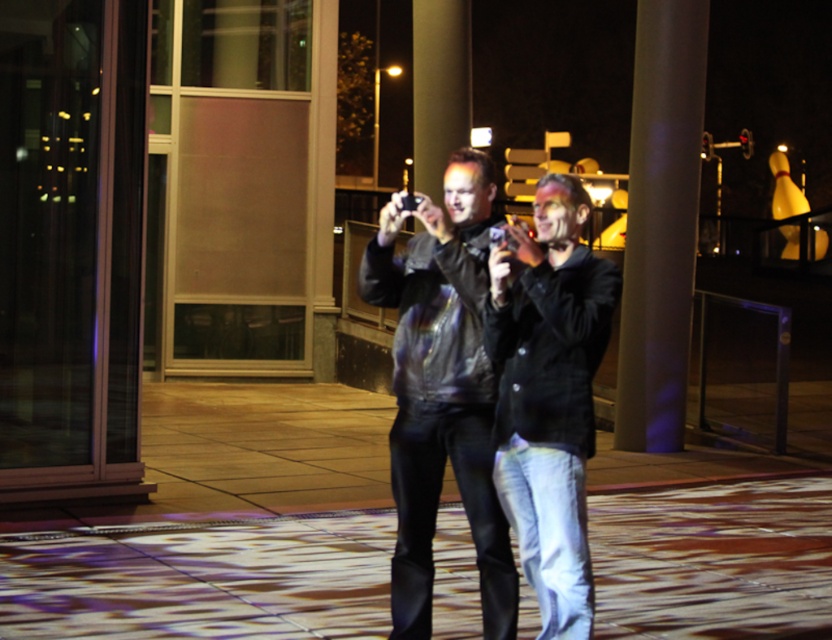
Question: Which of the following is the closest to the observer?

Choices:
 (A) (528, 273)
 (B) (404, 593)

Answer: (A)

Question: Is denim jeans at center thinner than shiny black jacket at center?

Choices:
 (A) yes
 (B) no

Answer: (A)

Question: From the image, what is the correct spatial relationship of denim jeans at center in relation to shiny black jacket at center?

Choices:
 (A) below
 (B) above

Answer: (A)

Question: Which point is farther to the camera?

Choices:
 (A) denim jeans at center
 (B) shiny black jacket at center

Answer: (B)

Question: Can you confirm if denim jeans at center is positioned to the left of shiny black jacket at center?

Choices:
 (A) yes
 (B) no

Answer: (A)

Question: Which of the following is the farthest from the observer?

Choices:
 (A) denim jeans at center
 (B) shiny black jacket at center

Answer: (B)